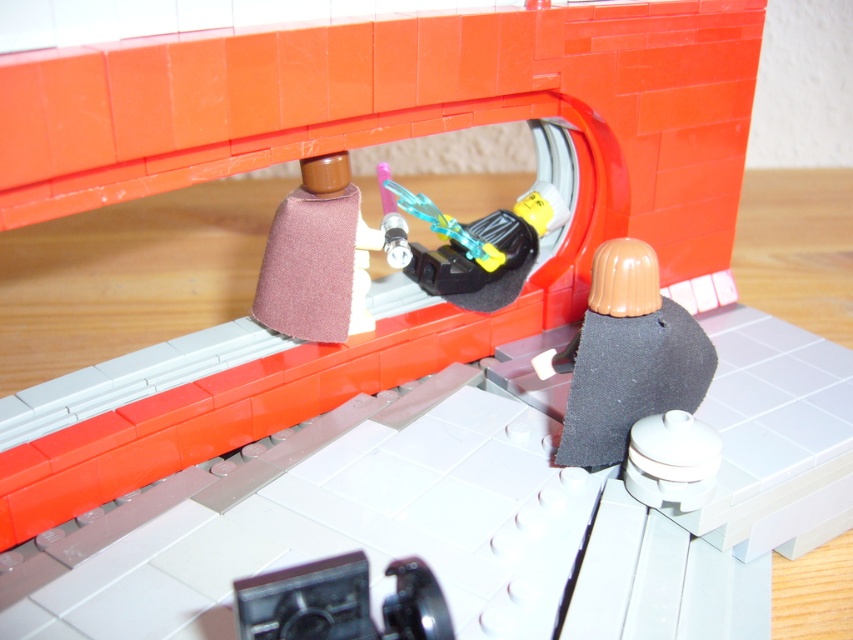
Question: Can you confirm if dark gray fabric at lower right is positioned above brown fabric cone at center?

Choices:
 (A) no
 (B) yes

Answer: (A)

Question: Which point is closer to the camera?

Choices:
 (A) brown fabric cone at center
 (B) dark gray fabric at lower right

Answer: (B)

Question: Among these objects, which one is farthest from the camera?

Choices:
 (A) brown fabric cone at center
 (B) dark gray fabric at lower right

Answer: (A)

Question: Is dark gray fabric at lower right smaller than brown fabric cone at center?

Choices:
 (A) no
 (B) yes

Answer: (B)

Question: Is dark gray fabric at lower right in front of brown fabric cone at center?

Choices:
 (A) yes
 (B) no

Answer: (A)